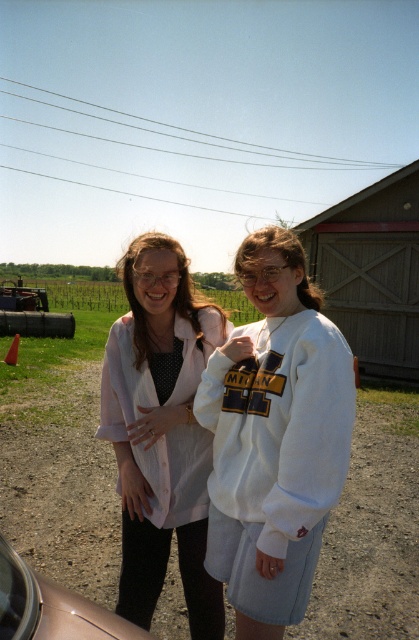
Is point (279, 396) behind point (137, 556)?

No, (279, 396) is in front of (137, 556).

Which is behind, point (323, 321) or point (160, 470)?

The point (160, 470) is behind.

The height and width of the screenshot is (640, 419). In order to click on white fleece sweatshirt at center in this screenshot , I will do `click(276, 458)`.

Can you confirm if dirt track at lower center is positioned to the left of white fleece sweatshirt at center?

Indeed, dirt track at lower center is positioned on the left side of white fleece sweatshirt at center.

Who is lower down, dirt track at lower center or white fleece sweatshirt at center?

dirt track at lower center

Which is in front, point (66, 426) or point (271, 556)?

Point (271, 556) is in front.

Locate an element on the screen. This screenshot has width=419, height=640. dirt track at lower center is located at coordinates (62, 483).

Can you confirm if white fleece sweatshirt at center is positioned to the right of metallic silver car at lower left?

Correct, you'll find white fleece sweatshirt at center to the right of metallic silver car at lower left.

Between white fleece sweatshirt at center and metallic silver car at lower left, which one is positioned lower?

metallic silver car at lower left is below.

Locate an element on the screen. white fleece sweatshirt at center is located at coordinates (276, 458).